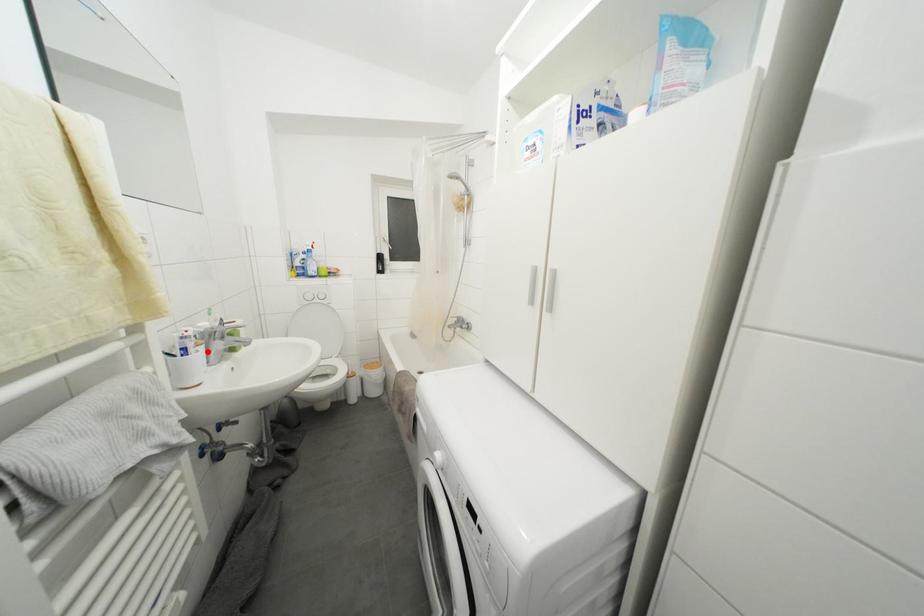
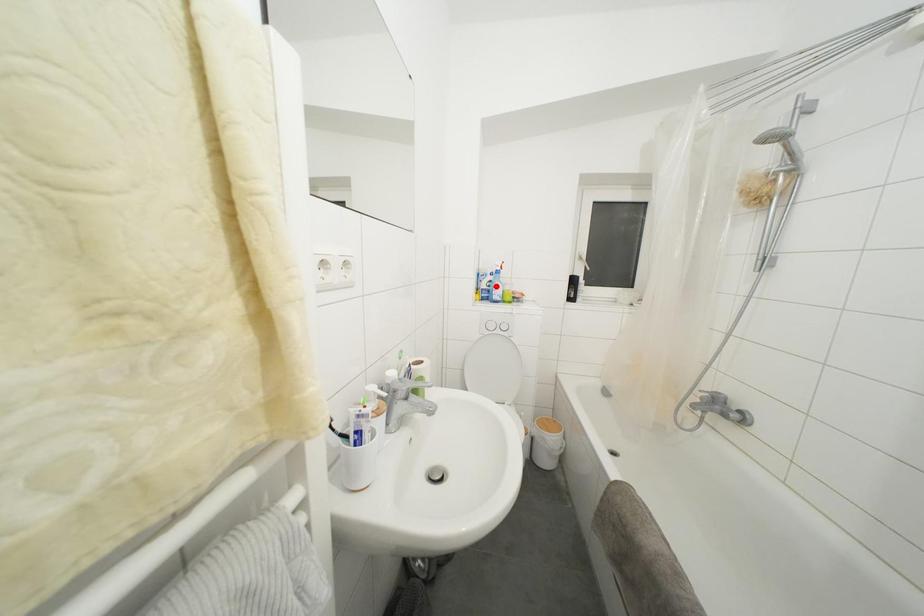
Based on the photo, I am providing you with two images of the same scene from different viewpoints. A red point is marked on the first image and another point is marked on the second image. Is the red point in image1 aligned with the point shown in image2?

No